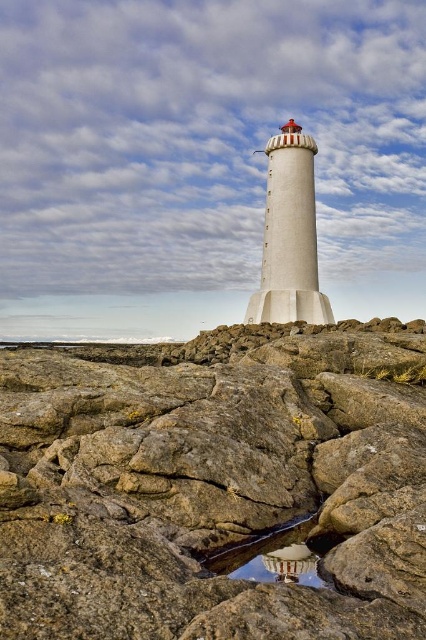
Question: Can you confirm if brown rough rock at center is smaller than transparent glass puddle at center?

Choices:
 (A) no
 (B) yes

Answer: (A)

Question: Where is brown rough rock at center located in relation to transparent glass puddle at center in the image?

Choices:
 (A) left
 (B) right

Answer: (B)

Question: Considering the relative positions of brown rough rock at center and transparent glass puddle at center in the image provided, where is brown rough rock at center located with respect to transparent glass puddle at center?

Choices:
 (A) left
 (B) right

Answer: (B)

Question: Which object appears closest to the camera in this image?

Choices:
 (A) transparent glass puddle at center
 (B) brown rough rock at center

Answer: (B)

Question: Which object is farther from the camera taking this photo?

Choices:
 (A) brown rough rock at center
 (B) transparent glass puddle at center

Answer: (B)